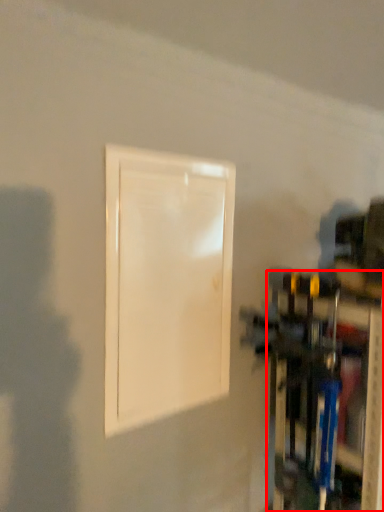
Question: From the image's perspective, where is shelf (annotated by the red box) located in relation to door in the image?

Choices:
 (A) above
 (B) below

Answer: (B)